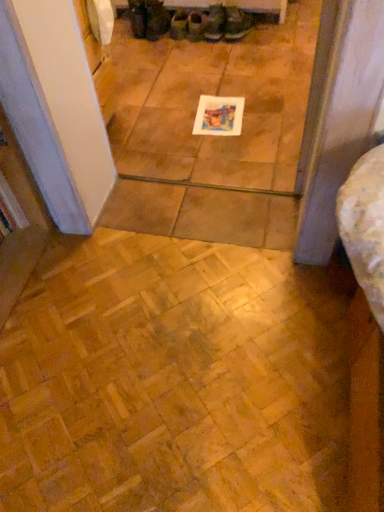
Question: From the image's perspective, is dark brown leather boot at upper center, the 2th footwear in the left-to-right sequence, located above or below green canvas shoes at upper center, arranged as the 4th footwear when viewed from the right?

Choices:
 (A) below
 (B) above

Answer: (B)

Question: Based on their sizes in the image, would you say dark brown leather boot at upper center, the 2th footwear in the left-to-right sequence, is bigger or smaller than green canvas shoes at upper center, arranged as the 4th footwear when viewed from the right?

Choices:
 (A) small
 (B) big

Answer: (B)

Question: Which is nearer to the leather boot at center, the second footwear viewed from the right?

Choices:
 (A) white paper at center
 (B) dark brown leather boot at upper center, which appears as the fifth footwear when viewed from the right
 (C) wooden parquet floor at lower left
 (D) matte green fabric shoe at center, which ranks as the 3th footwear in right-to-left order
 (E) green canvas shoes at upper center, positioned as the 3th footwear in left-to-right order

Answer: (D)

Question: Which of these objects is positioned closest to the green canvas shoes at upper center, arranged as the 4th footwear when viewed from the right?

Choices:
 (A) matte black shoes at upper center, the sixth footwear from the right
 (B) white paper at center
 (C) leather boot at center, the second footwear viewed from the right
 (D) dark brown leather boot at upper center, which appears as the fifth footwear when viewed from the right
 (E) matte green fabric shoe at center, which ranks as the 3th footwear in right-to-left order

Answer: (E)